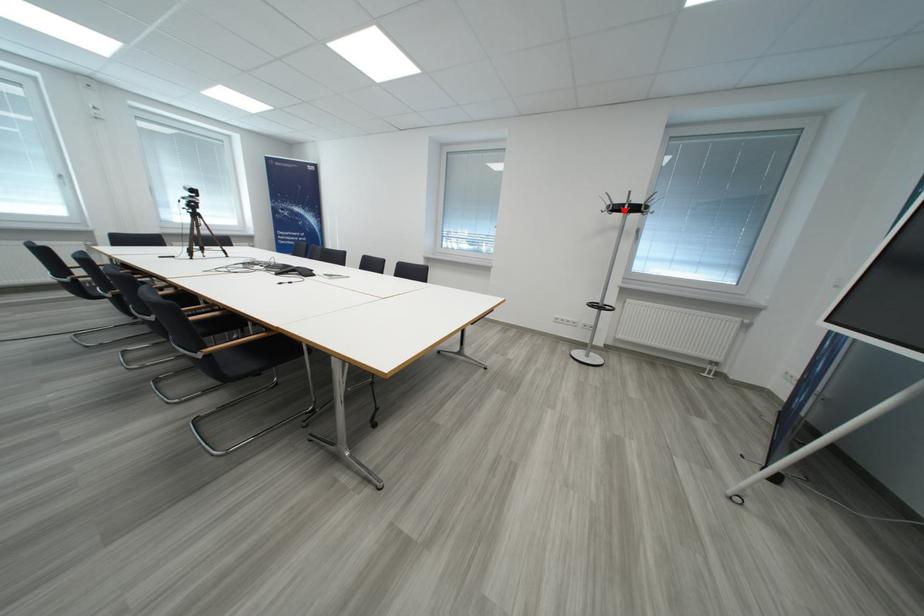
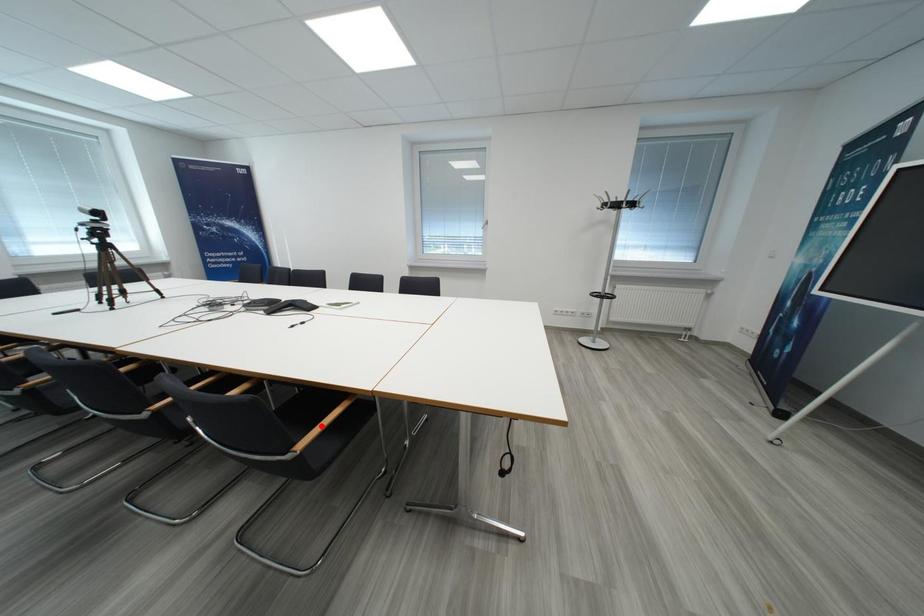
I am providing you with two images of the same scene from different viewpoints. A red point is marked on the first image and another point is marked on the second image. Is the red point in image1 aligned with the point shown in image2?

No